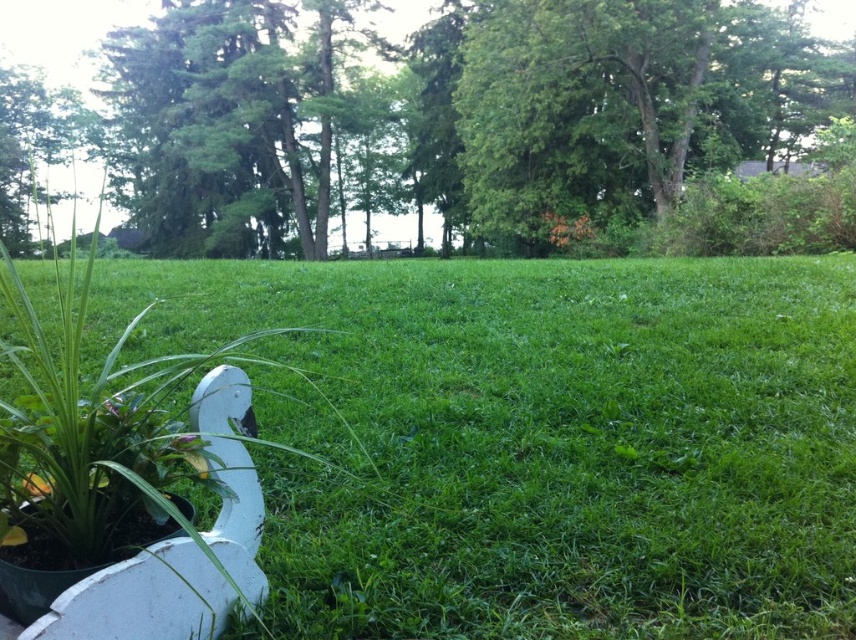
Question: Which of the following is the farthest from the observer?

Choices:
 (A) (512, 502)
 (B) (195, 435)

Answer: (A)

Question: Does green leafy tree at upper center appear on the left side of orange matte flower at center?

Choices:
 (A) no
 (B) yes

Answer: (B)

Question: Is green leafy tree at upper left below orange matte flower at center?

Choices:
 (A) no
 (B) yes

Answer: (A)

Question: Among these objects, which one is nearest to the camera?

Choices:
 (A) green grassy at lower left
 (B) green matte flower at lower left
 (C) orange matte flower at center
 (D) green leafy tree at upper left

Answer: (B)

Question: Can you confirm if green grassy at lower left is positioned above green leafy tree at upper left?

Choices:
 (A) no
 (B) yes

Answer: (A)

Question: Which object is farther from the camera taking this photo?

Choices:
 (A) green grassy at lower left
 (B) green leafy tree at upper center
 (C) green matte flower at lower left

Answer: (B)